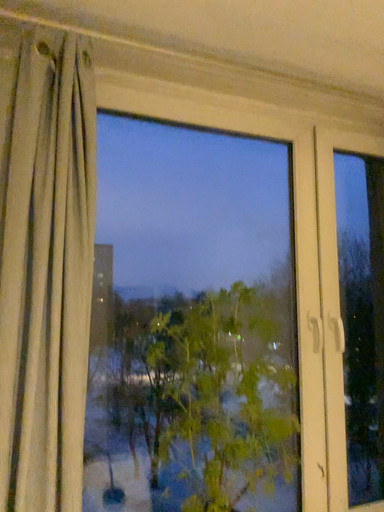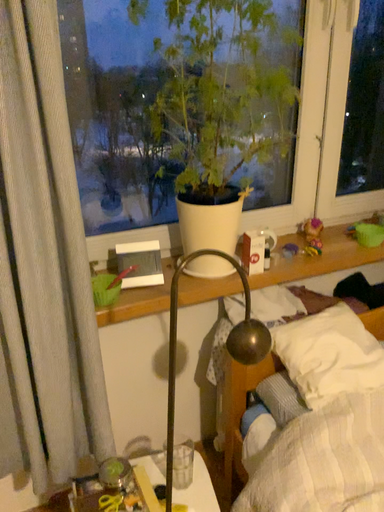
Question: How did the camera likely rotate when shooting the video?

Choices:
 (A) rotated downward
 (B) rotated upward

Answer: (A)